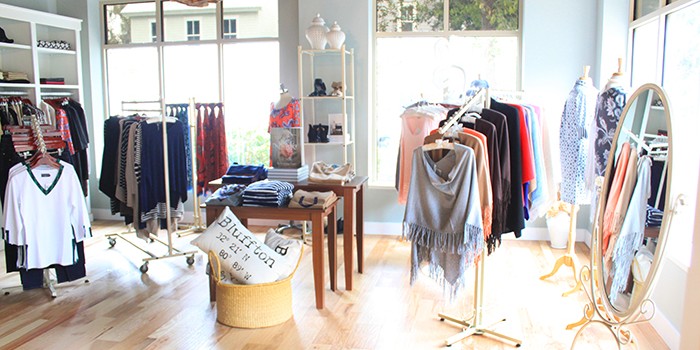
Find the location of a particular element. The image size is (700, 350). oval mirror is located at coordinates (640, 175).